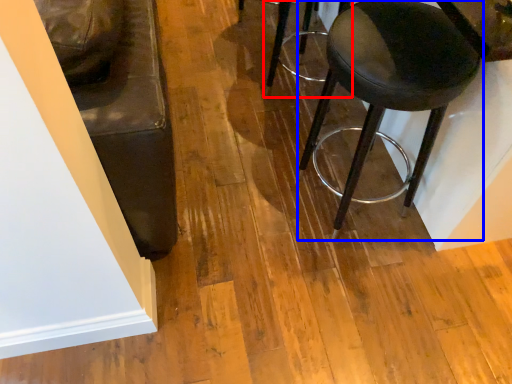
Question: Which of the following is the closest to the observer, stool (highlighted by a red box) or stool (highlighted by a blue box)?

Choices:
 (A) stool
 (B) stool

Answer: (B)